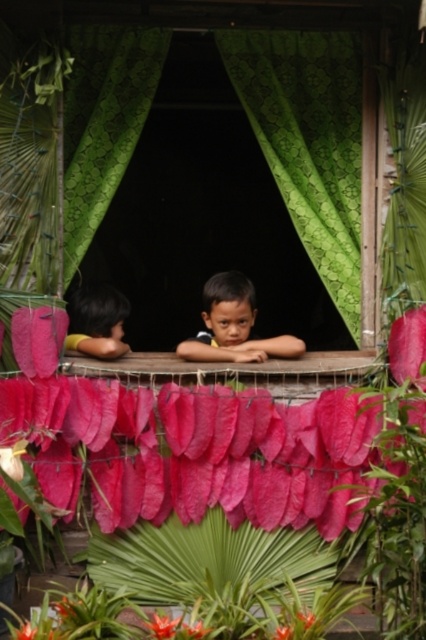
Is green lace curtain at center smaller than dark brown hair at left?

Yes.

Describe the element at coordinates (103, 122) in the screenshot. Image resolution: width=426 pixels, height=640 pixels. I see `green lace curtain at center` at that location.

Which is behind, point (138, 97) or point (94, 310)?

Positioned behind is point (94, 310).

You are a GUI agent. You are given a task and a screenshot of the screen. Output one action in this format:
    pyautogui.click(x=<x>, y=<y>)
    Task: Click on the green lace curtain at center
    
    Given the screenshot: What is the action you would take?
    pyautogui.click(x=103, y=122)

Does green lace curtain at center have a larger size compared to green matte leaf at center?

Yes, green lace curtain at center is bigger than green matte leaf at center.

Between green lace curtain at center and green matte leaf at center, which one appears on the right side from the viewer's perspective?

green lace curtain at center is more to the right.

The width and height of the screenshot is (426, 640). Describe the element at coordinates (103, 122) in the screenshot. I see `green lace curtain at center` at that location.

The height and width of the screenshot is (640, 426). Find the location of `green lace curtain at center`. green lace curtain at center is located at coordinates (103, 122).

Is orange matte flower at lower center closer to camera compared to bright pink paper at center?

Yes, orange matte flower at lower center is closer to the viewer.

Who is more distant from viewer, (170, 628) or (310, 614)?

Positioned behind is point (310, 614).

This screenshot has height=640, width=426. I want to click on orange matte flower at lower center, so click(x=163, y=625).

This screenshot has width=426, height=640. Find the location of `orange matte flower at lower center`. orange matte flower at lower center is located at coordinates (163, 625).